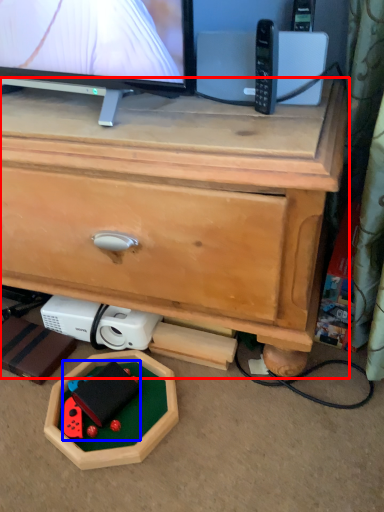
Question: Which point is further to the camera, chest of drawers (highlighted by a red box) or toy (highlighted by a blue box)?

Choices:
 (A) chest of drawers
 (B) toy

Answer: (B)